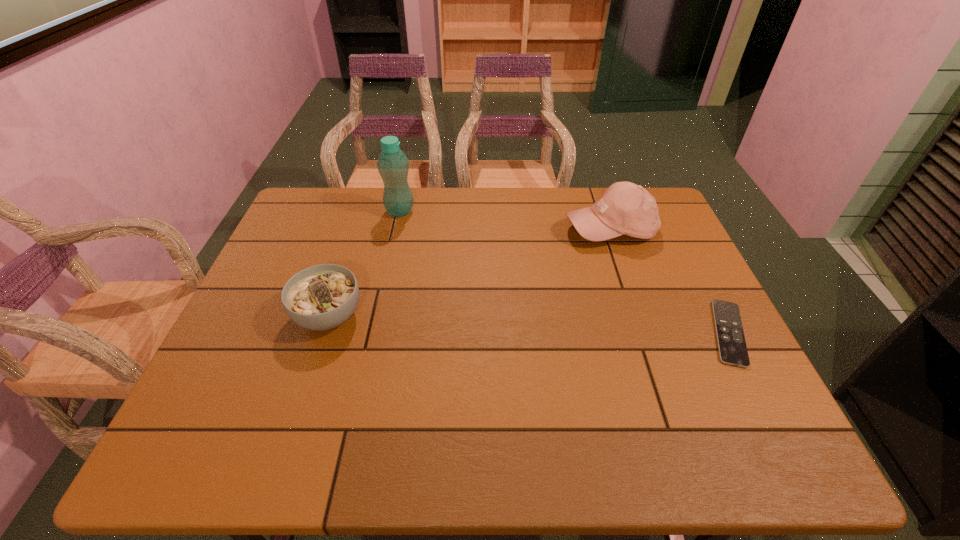
The width and height of the screenshot is (960, 540). In order to click on free space on the desktop that is between the soup bowl and the shortest object and is positioned on the front-facing side of the third shortest object in this screenshot , I will do `click(585, 327)`.

In order to click on free space on the desktop that is between the soup bowl and the remote control and is positioned at the front cap of the tallest object in this screenshot , I will do `click(536, 325)`.